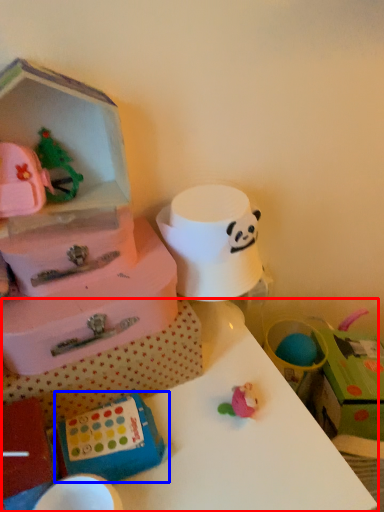
Question: Which object appears closest to the camera in this image, table (highlighted by a red box) or box (highlighted by a blue box)?

Choices:
 (A) table
 (B) box

Answer: (A)